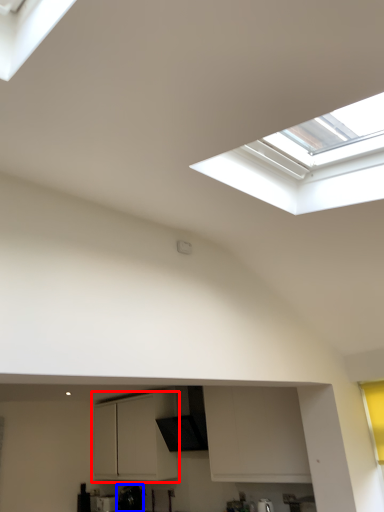
Question: Which object is further to the camera taking this photo, cabinetry (highlighted by a red box) or appliance (highlighted by a blue box)?

Choices:
 (A) cabinetry
 (B) appliance

Answer: (B)